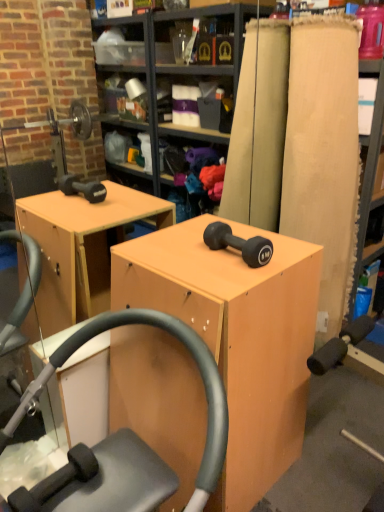
Question: Can you confirm if matte wood plank at right is thinner than matte black dumbbell at center?

Choices:
 (A) yes
 (B) no

Answer: (B)

Question: Considering the relative sizes of matte wood plank at right and matte black dumbbell at center in the image provided, is matte wood plank at right wider than matte black dumbbell at center?

Choices:
 (A) yes
 (B) no

Answer: (A)

Question: Is matte black dumbbell at center located within matte wood plank at right?

Choices:
 (A) no
 (B) yes

Answer: (A)

Question: Can you confirm if matte wood plank at right is bigger than matte black dumbbell at center?

Choices:
 (A) no
 (B) yes

Answer: (B)

Question: From the image's perspective, is matte wood plank at right beneath matte black dumbbell at center?

Choices:
 (A) no
 (B) yes

Answer: (A)

Question: From a real-world perspective, is matte wood plank at right physically below matte black dumbbell at center?

Choices:
 (A) no
 (B) yes

Answer: (B)

Question: Would you say matte black dumbbell at center is a long distance from matte wood plank at right?

Choices:
 (A) no
 (B) yes

Answer: (A)

Question: From a real-world perspective, is matte black dumbbell at center physically above matte wood plank at right?

Choices:
 (A) no
 (B) yes

Answer: (B)

Question: Can matte wood plank at right be found inside matte black dumbbell at center?

Choices:
 (A) no
 (B) yes

Answer: (A)

Question: From a real-world perspective, is matte black dumbbell at center under matte wood plank at right?

Choices:
 (A) yes
 (B) no

Answer: (B)

Question: Is the depth of matte black dumbbell at center less than that of matte wood plank at right?

Choices:
 (A) yes
 (B) no

Answer: (A)

Question: Can you see matte black dumbbell at center touching matte wood plank at right?

Choices:
 (A) yes
 (B) no

Answer: (B)

Question: Can you confirm if matte wood cabinet at center is positioned to the right of matte wood plank at right?

Choices:
 (A) no
 (B) yes

Answer: (A)